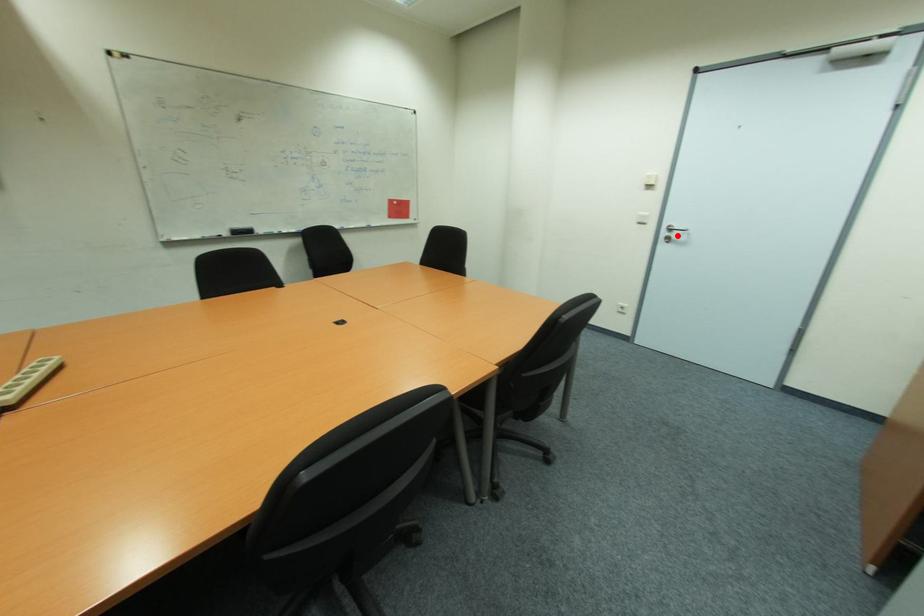
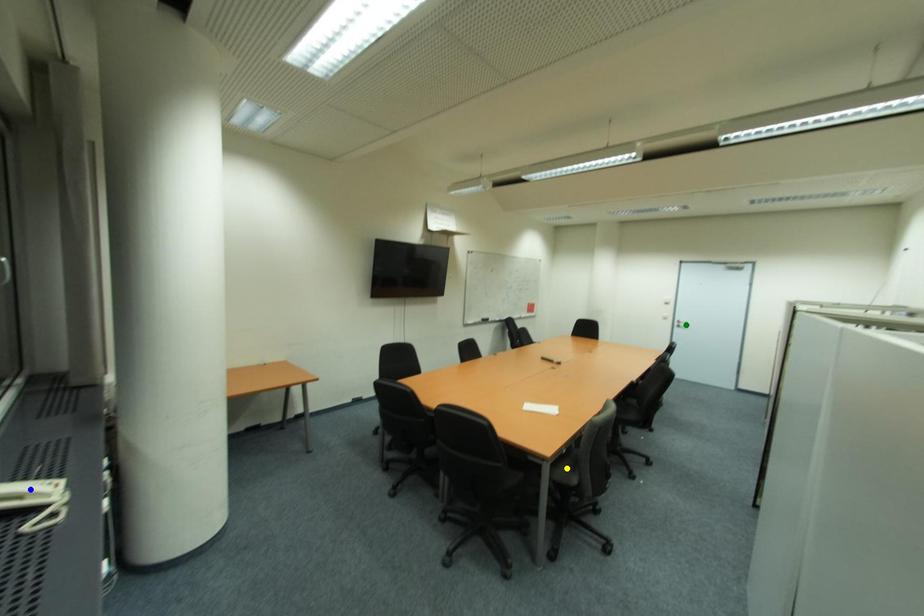
Question: I am providing you with two images of the same scene from different viewpoints. A red point is marked on the first image. You are given multiple points on the second image. Which mark in image 2 goes with the point in image 1?

Choices:
 (A) blue point
 (B) yellow point
 (C) green point

Answer: (C)